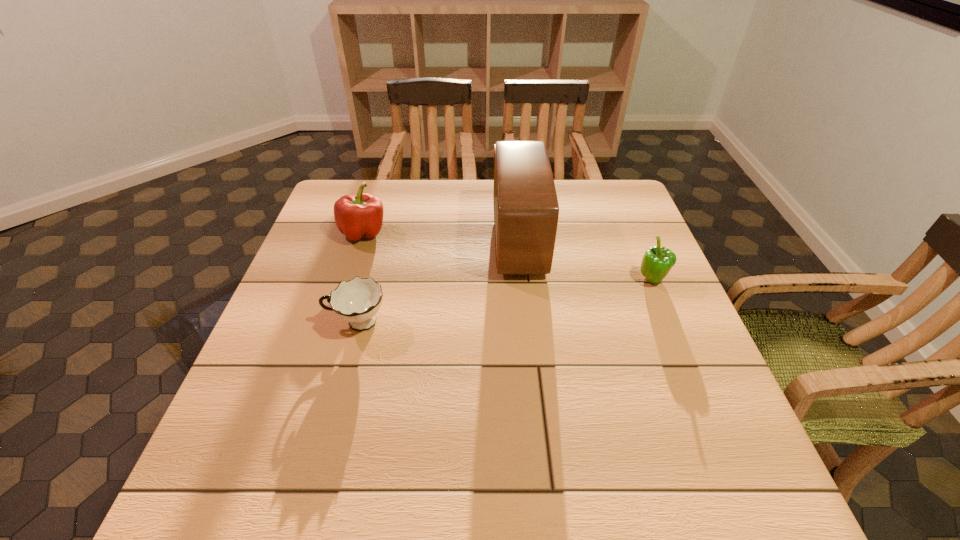
Find the location of `free space at the near edge of the desktop`. free space at the near edge of the desktop is located at coordinates (499, 496).

Find the location of a particular element. The height and width of the screenshot is (540, 960). blank area at the left edge is located at coordinates (313, 227).

This screenshot has height=540, width=960. In the image, there is a desktop. What are the coordinates of `vacant region at the right edge` in the screenshot? It's located at (636, 273).

Where is `vacant space at the far right corner of the desktop`? This screenshot has height=540, width=960. vacant space at the far right corner of the desktop is located at coordinates (594, 195).

In the image, there is a desktop. Where is `vacant space at the near right corner`? vacant space at the near right corner is located at coordinates (700, 511).

Image resolution: width=960 pixels, height=540 pixels. I want to click on free space between the cup and the right bell pepper, so click(x=505, y=301).

Where is `free space that is in between the tallest object and the nearer bell pepper`? The image size is (960, 540). free space that is in between the tallest object and the nearer bell pepper is located at coordinates (586, 260).

This screenshot has height=540, width=960. I want to click on free space between the shortest object and the nearer bell pepper, so click(505, 301).

This screenshot has height=540, width=960. I want to click on free space between the rightmost object and the tallest object, so point(586,260).

At what (x,y) coordinates should I click in order to perform the action: click on vacant space that's between the nearest object and the radio receiver. Please return your answer as a coordinate pair (x, y). Looking at the image, I should click on (438, 282).